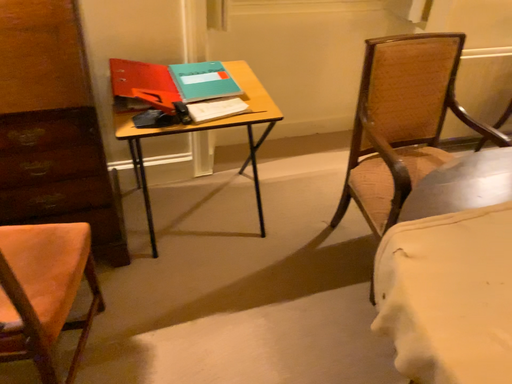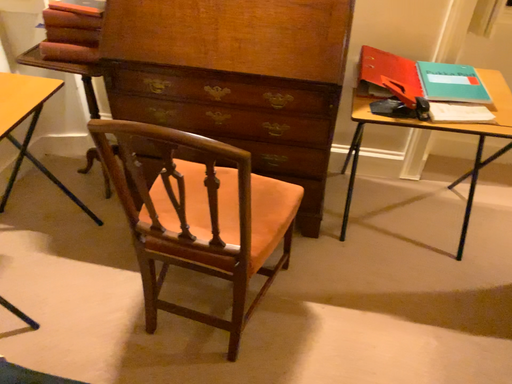
Question: Which way did the camera rotate in the video?

Choices:
 (A) rotated right
 (B) rotated left

Answer: (B)